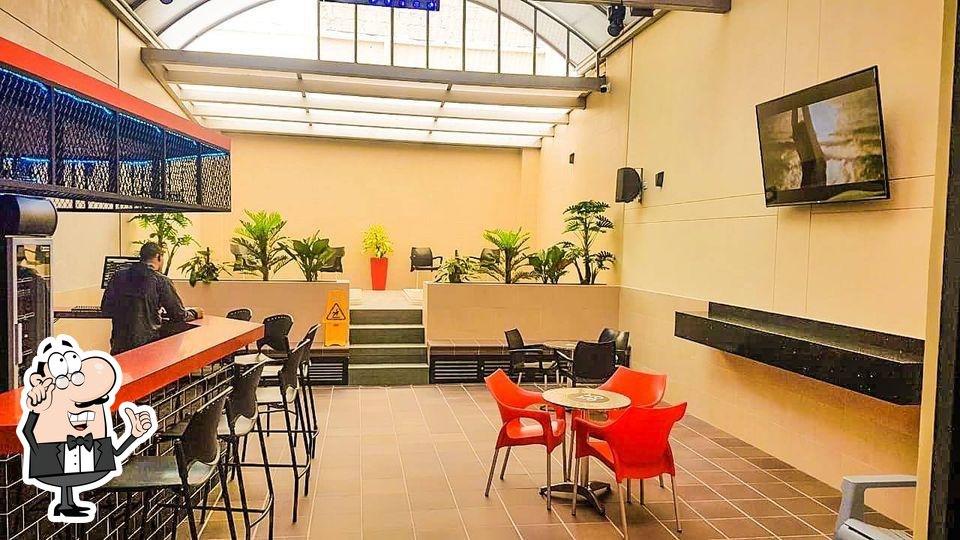
At what (x,y) coordinates should I click in order to perform the action: click on gray chair arm. Please return your answer as a coordinate pair (x, y). The height and width of the screenshot is (540, 960). Looking at the image, I should click on (852, 491).